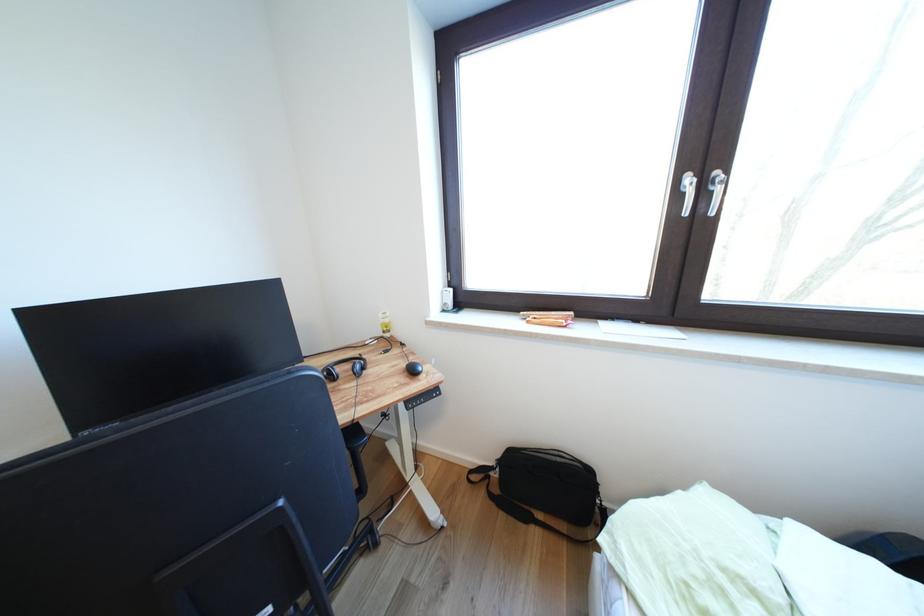
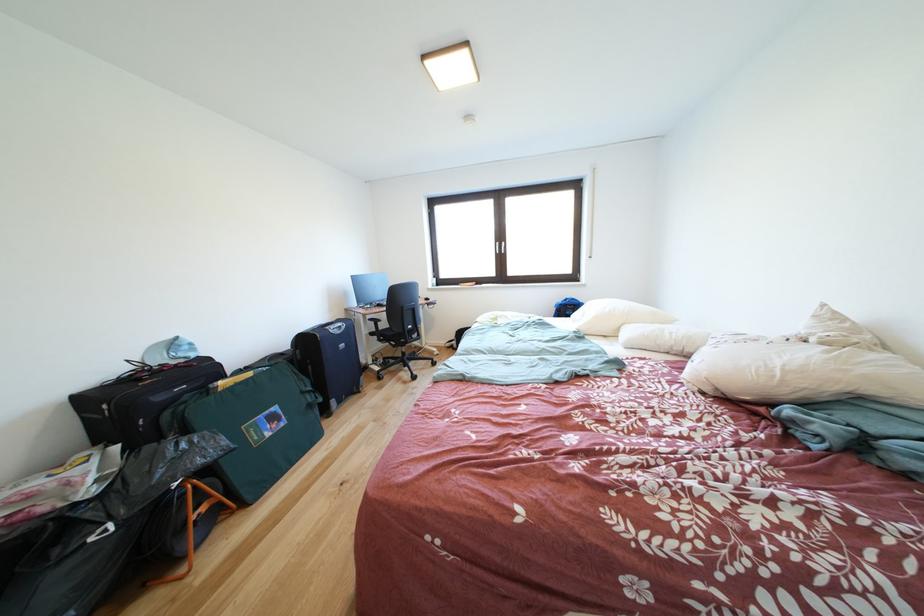
Locate, in the second image, the point that corresponds to pixel 698 184 in the first image.

(505, 249)